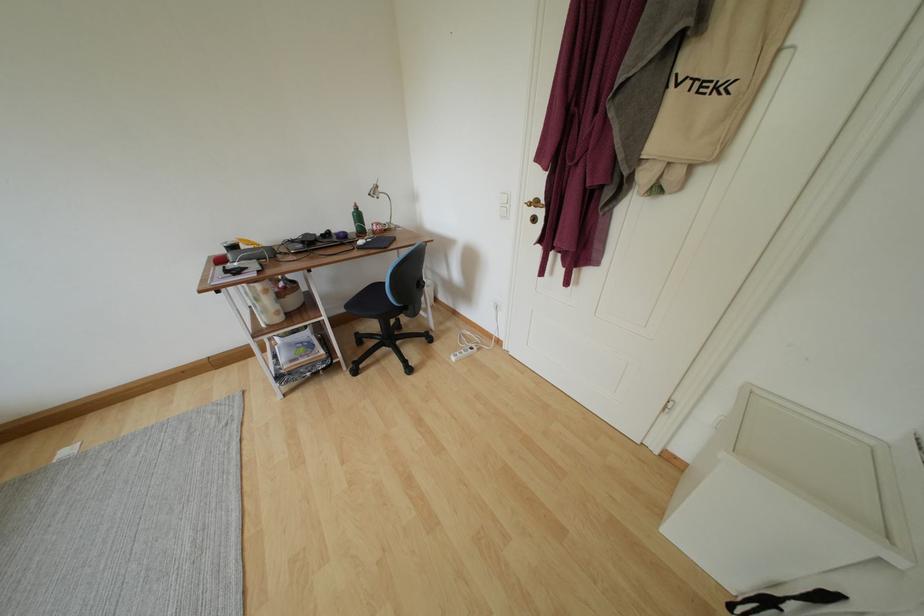
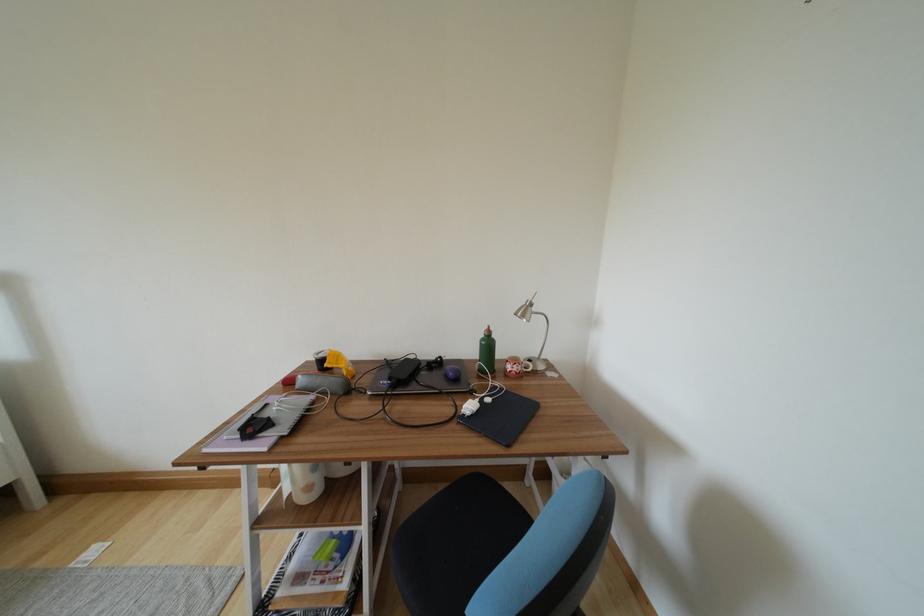
Locate, in the second image, the point that corresponds to (x=363, y=220) in the first image.

(493, 349)